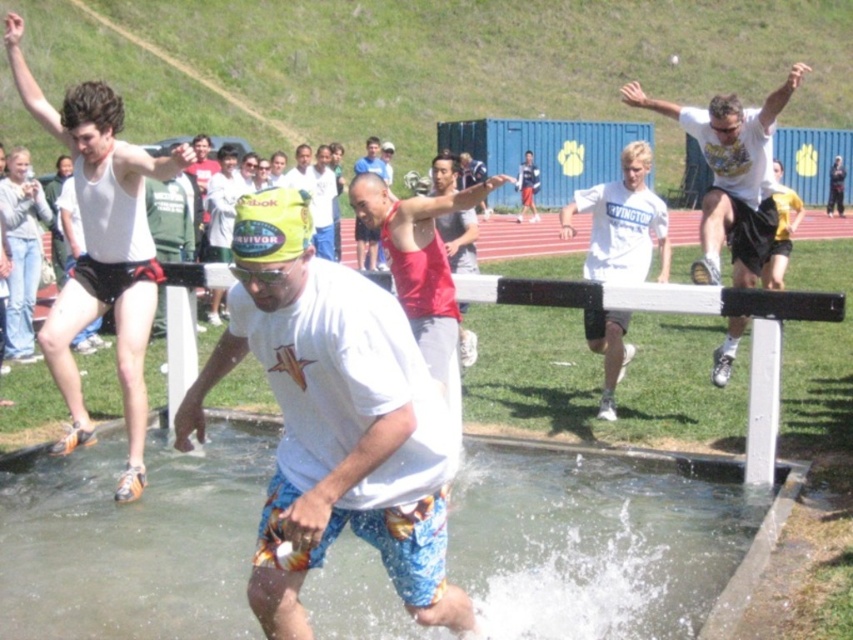
You are a photographer positioned at the camera location. You want to capture a photo that includes both the point at (721, 595) and the point at (440, 234). Which point should you focus on first to ensure both are in sharp focus?

You should focus on point (721, 595) first because it is closer to the camera than point (440, 234), so focusing on the closer point will help ensure both are within the depth of field.

You are a participant in the obstacle course and need to jump from the red tank top at center to the clear water at puddle center. Can you make the jump? Please explain your reasoning.

The clear water at puddle center is 5.91 feet away from the red tank top at center. Assuming an average jump distance for an adult is around 4 to 5 feet, the distance required is beyond the typical jump range. Therefore, it might be challenging to make the jump successfully.